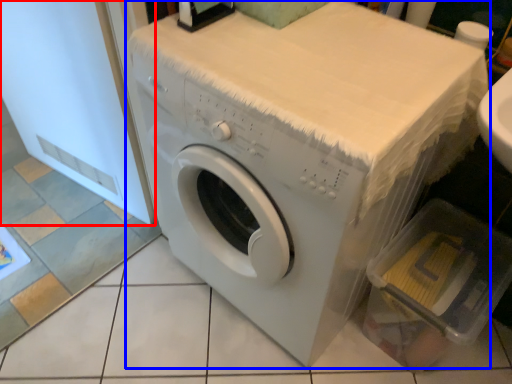
Question: Which object is further to the camera taking this photo, screen door (highlighted by a red box) or washing machine (highlighted by a blue box)?

Choices:
 (A) screen door
 (B) washing machine

Answer: (A)